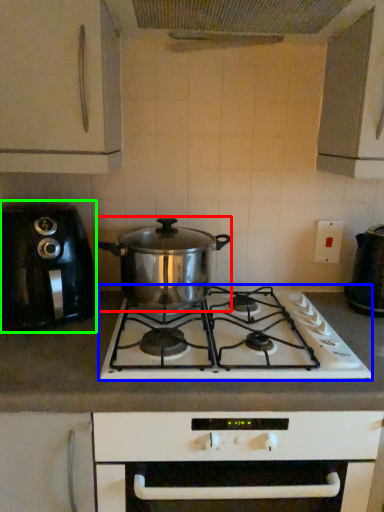
Question: Based on their relative distances, which object is nearer to slow cooker (highlighted by a red box)? Choose from gas stove (highlighted by a blue box) and kitchen appliance (highlighted by a green box).

Choices:
 (A) gas stove
 (B) kitchen appliance

Answer: (A)